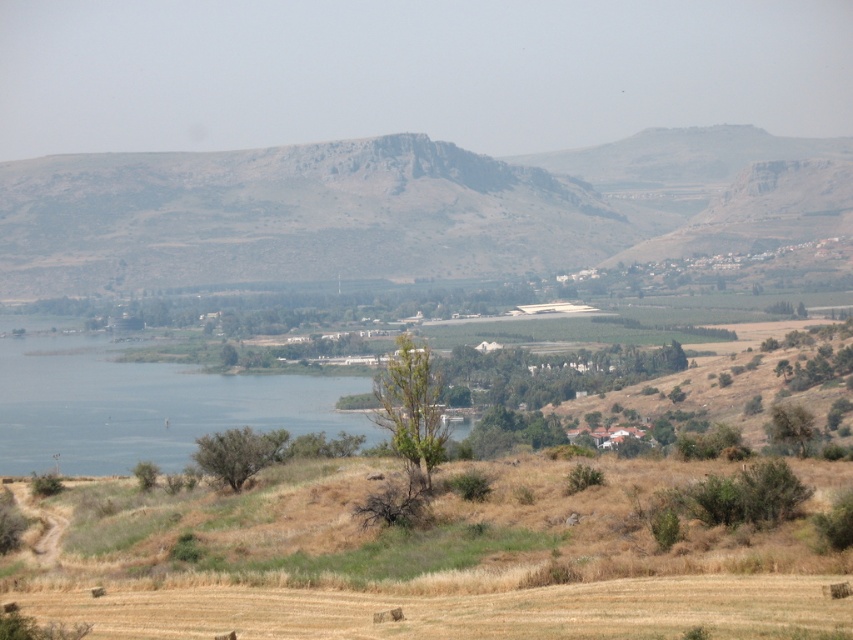
Does rugged stone mountain at center have a lesser height compared to blue water at center?

Incorrect, rugged stone mountain at center's height does not fall short of blue water at center's.

Describe the element at coordinates (399, 209) in the screenshot. I see `rugged stone mountain at center` at that location.

Locate an element on the screen. This screenshot has height=640, width=853. rugged stone mountain at center is located at coordinates (x=399, y=209).